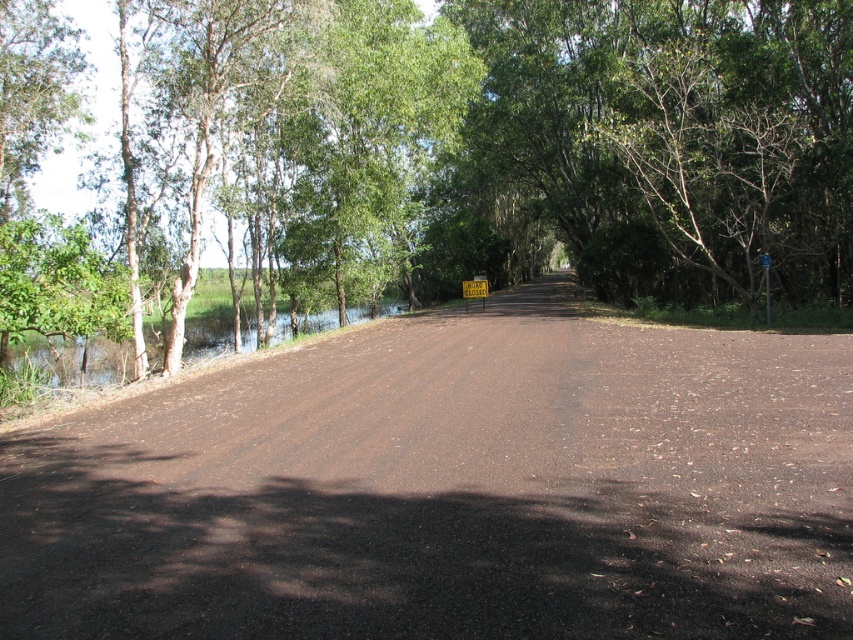
Consider the image. You are standing at the starting point of the road and want to walk towards the green leafy tree at center. In which direction should you head relative to the road?

The green leafy tree at center is located at coordinates 0.242 on the x axis and 0.515 on the y axis. Since the road is centered in the image, you should walk straight ahead along the road to reach the green leafy tree at center.

You are standing at the starting point of the rural road and see two points marked on the road ahead. The first point is at coordinates point (462, 179) and the second point is at point (764, 276). Which point is closer to you as you look down the road?

Point (462, 179) is closer to you because it is further to the viewer than point (764, 276).

You are a hiker who wants to find the yellow plastic sign at center. You see the green leafy water at left. Which direction should you walk to reach the sign?

The green leafy water at left is positioned under the yellow plastic sign at center, so the sign is above the water. Walk towards the center of the road where the sign is located above the green leafy water at left.